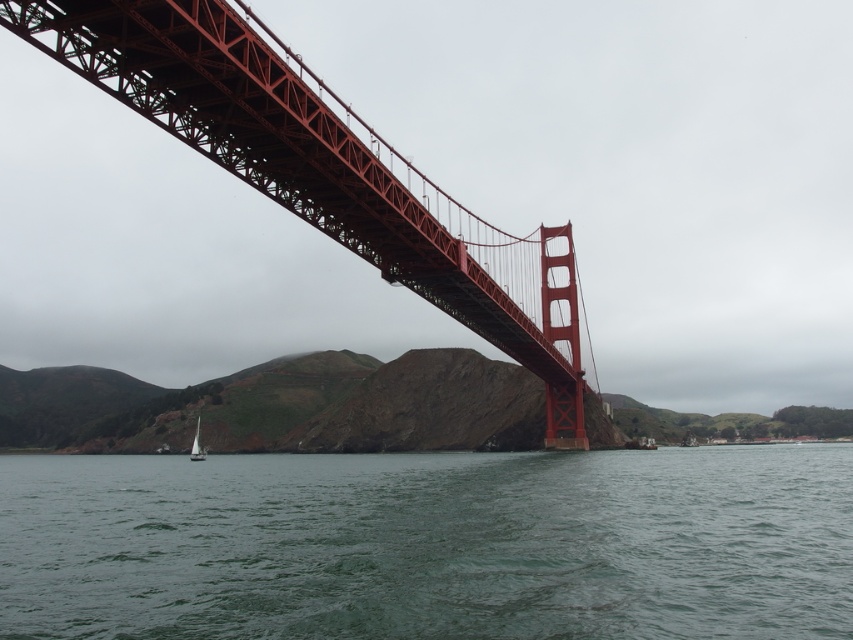
Question: Which object is farther from the camera taking this photo?

Choices:
 (A) green water at lower center
 (B) red steel suspension bridge at upper center

Answer: (B)

Question: Which point is closer to the camera?

Choices:
 (A) (86, 538)
 (B) (228, 116)

Answer: (B)

Question: Which of the following is the closest to the observer?

Choices:
 (A) red steel suspension bridge at upper center
 (B) green water at lower center

Answer: (B)

Question: Is green water at lower center positioned behind red steel suspension bridge at upper center?

Choices:
 (A) yes
 (B) no

Answer: (B)

Question: Does green water at lower center appear over red steel suspension bridge at upper center?

Choices:
 (A) yes
 (B) no

Answer: (B)

Question: Is green water at lower center smaller than red steel suspension bridge at upper center?

Choices:
 (A) no
 (B) yes

Answer: (A)